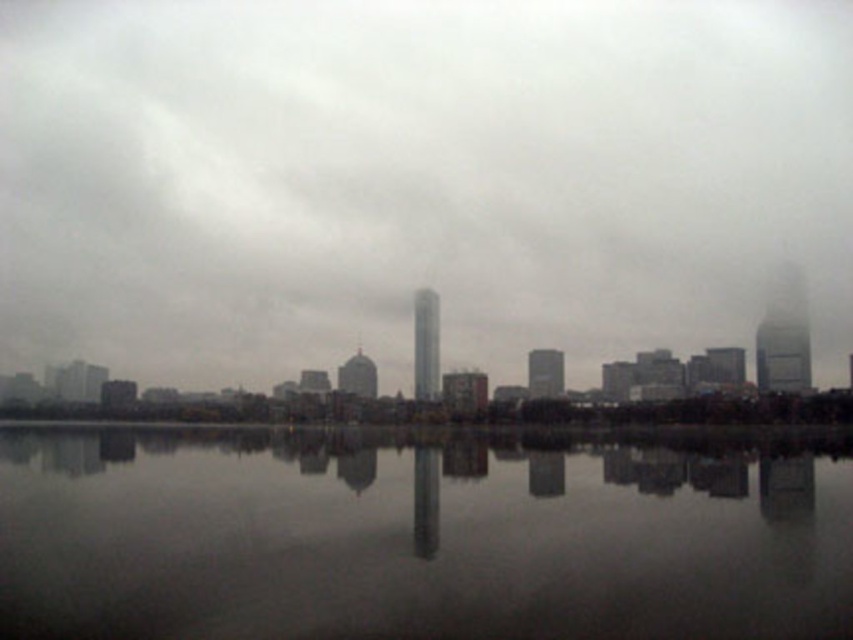
Based on the photo, you are standing at the edge of the water and want to walk towards the city skyline. Which point, point (364,291) or point (277,522), is closer to the city skyline?

→ Point (277,522) is closer to the city skyline because it is in front of point (364,291).

You are a photographer planning to capture the cityscape reflection in the water. Given the gray foggy sky at center and the reflective glass water at center, which one is wider in the scene?

The gray foggy sky at center is wider than the reflective glass water at center according to the description.

You are a photographer planning to capture the cityscape reflected in the water. Given the presence of the gray foggy sky at center and reflective glass water at center, which object might obstruct the reflection of the city skyline and why?

The gray foggy sky at center might obstruct the reflection of the city skyline because it has a larger size compared to the reflective glass water at center, potentially covering more of the reflection area.